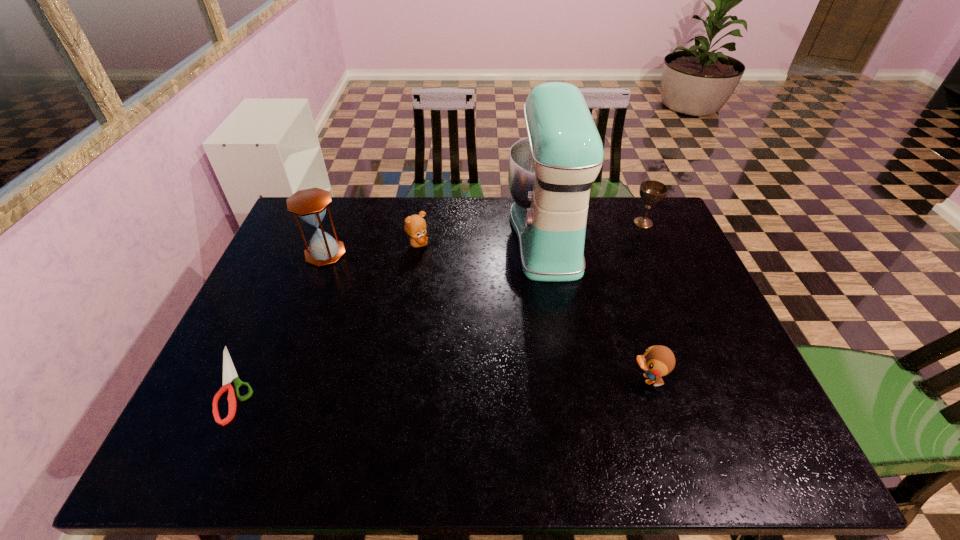
This screenshot has height=540, width=960. I want to click on unoccupied area between the rightmost object and the duck, so click(645, 301).

Find the location of `free space that is in between the hourglass and the fourth object from left to right`. free space that is in between the hourglass and the fourth object from left to right is located at coordinates (436, 245).

Find the location of a particular element. This screenshot has height=540, width=960. unoccupied area between the third tallest object and the mixer is located at coordinates (595, 229).

Point out which object is positioned as the third nearest to the second object from right to left. Please provide its 2D coordinates. Your answer should be formatted as a tuple, i.e. [(x, y)], where the tuple contains the x and y coordinates of a point satisfying the conditions above.

[(415, 226)]

Choose which object is the second nearest neighbor to the duck. Please provide its 2D coordinates. Your answer should be formatted as a tuple, i.e. [(x, y)], where the tuple contains the x and y coordinates of a point satisfying the conditions above.

[(651, 191)]